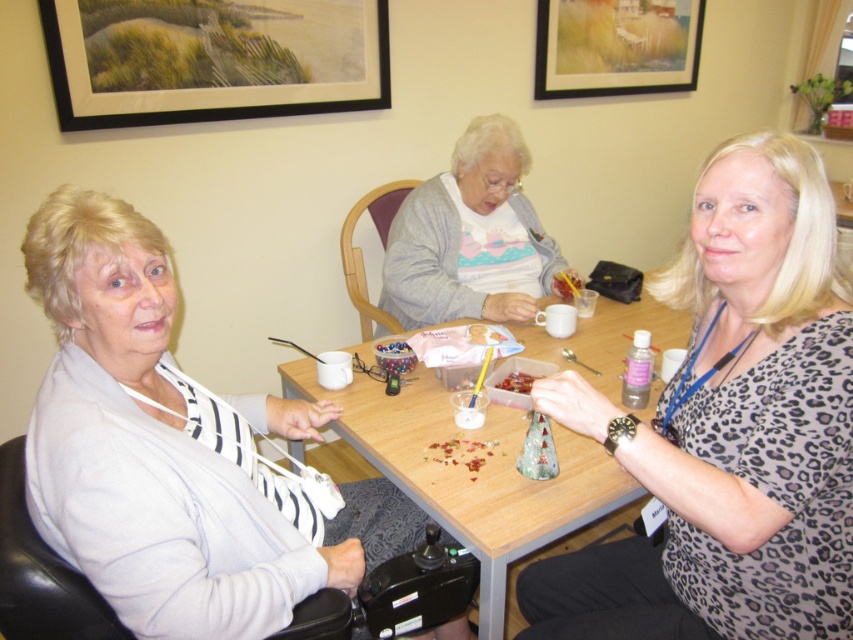
Question: Which object is the farthest from the wooden table at center?

Choices:
 (A) black framed picture at upper left
 (B) leopard print blouse at center

Answer: (A)

Question: Can you confirm if black framed picture at upper left is smaller than gray sweater at center?

Choices:
 (A) no
 (B) yes

Answer: (A)

Question: Which of these objects is positioned farthest from the light gray sweater at left?

Choices:
 (A) leopard print blouse at center
 (B) wooden table at center
 (C) black framed picture at upper left
 (D) matte gold picture frame at upper center

Answer: (D)

Question: Can you confirm if light gray sweater at left is thinner than wooden table at center?

Choices:
 (A) no
 (B) yes

Answer: (B)

Question: Which point is farther from the camera taking this photo?

Choices:
 (A) (434, 499)
 (B) (577, 65)

Answer: (B)

Question: In this image, where is gray sweater at center located relative to matte gold picture frame at upper center?

Choices:
 (A) right
 (B) left

Answer: (B)